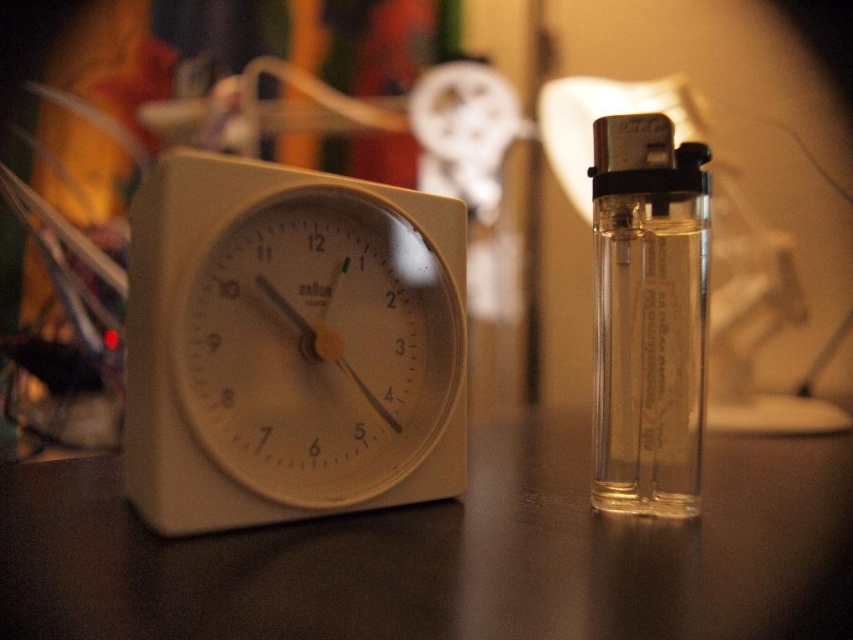
You are trying to reach for the clear glass lighter at right while avoiding touching the white plastic clock at left. Based on their positions, can you safely move your hand between them without knocking over the clock?

The white plastic clock at left is closer to the viewer than the clear glass lighter at right, so moving your hand between them might risk knocking over the clock since it is closer and in the direct path.

You are trying to place both the matte white clock at left and the white plastic clock at left on a narrow shelf. Which clock should you choose to fit better on the shelf?

The white plastic clock at left is narrower than the matte white clock at left, so it will fit better on the narrow shelf.